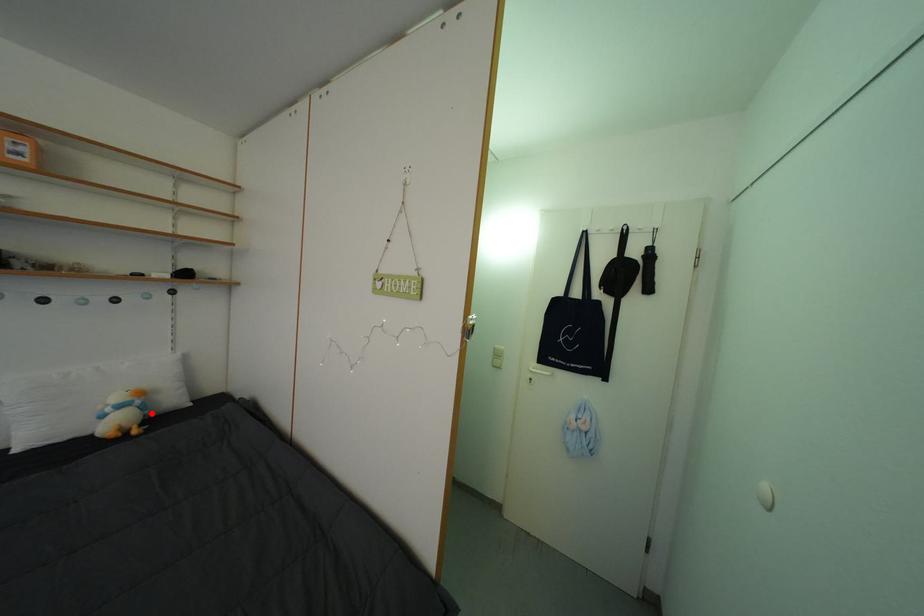
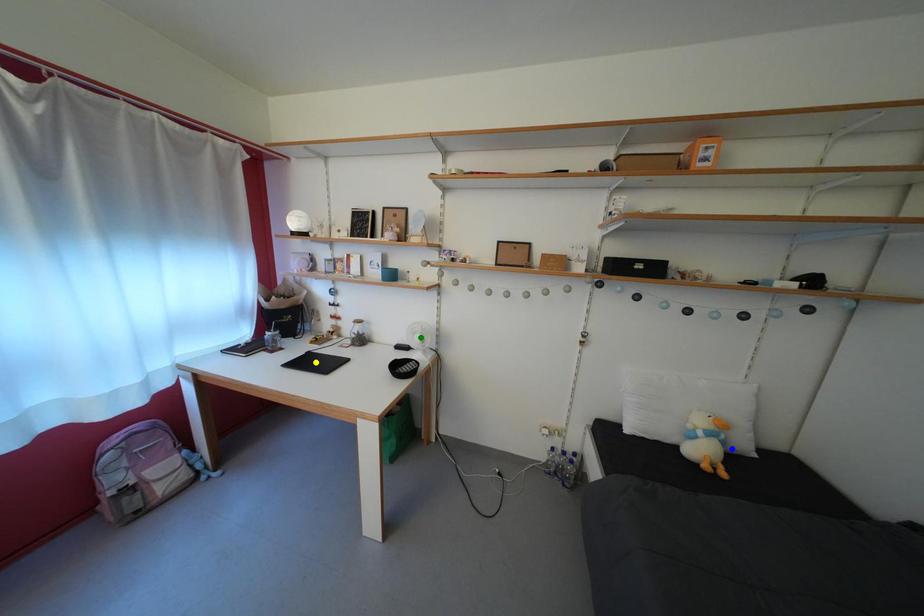
Question: I am providing you with two images of the same scene from different viewpoints. A red point is marked on the first image. You are given multiple points on the second image. Which spot in image 2 lines up with the point in image 1?

Choices:
 (A) yellow point
 (B) green point
 (C) blue point

Answer: (C)